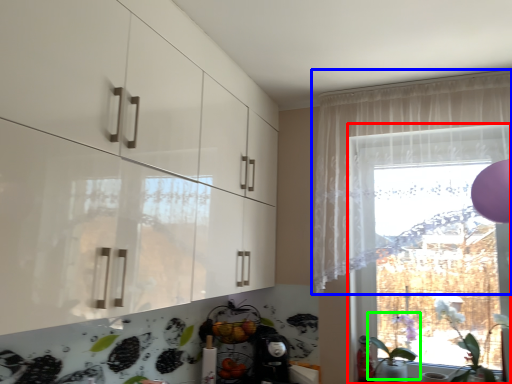
Question: Estimate the real-world distances between objects in this image. Which object is farther from window (highlighted by a red box), curtain (highlighted by a blue box) or plant (highlighted by a green box)?

Choices:
 (A) curtain
 (B) plant

Answer: (B)